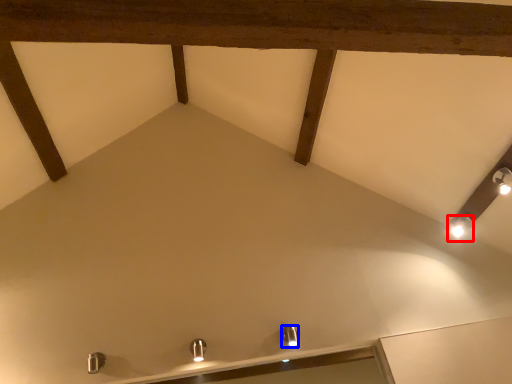
Question: Which point is further to the camera, light fixture (highlighted by a red box) or light fixture (highlighted by a blue box)?

Choices:
 (A) light fixture
 (B) light fixture

Answer: (A)